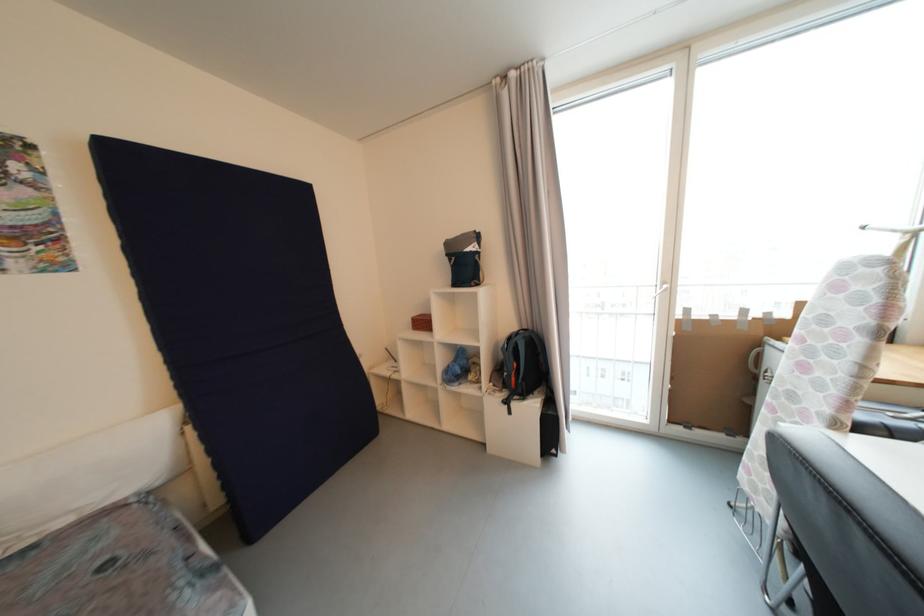
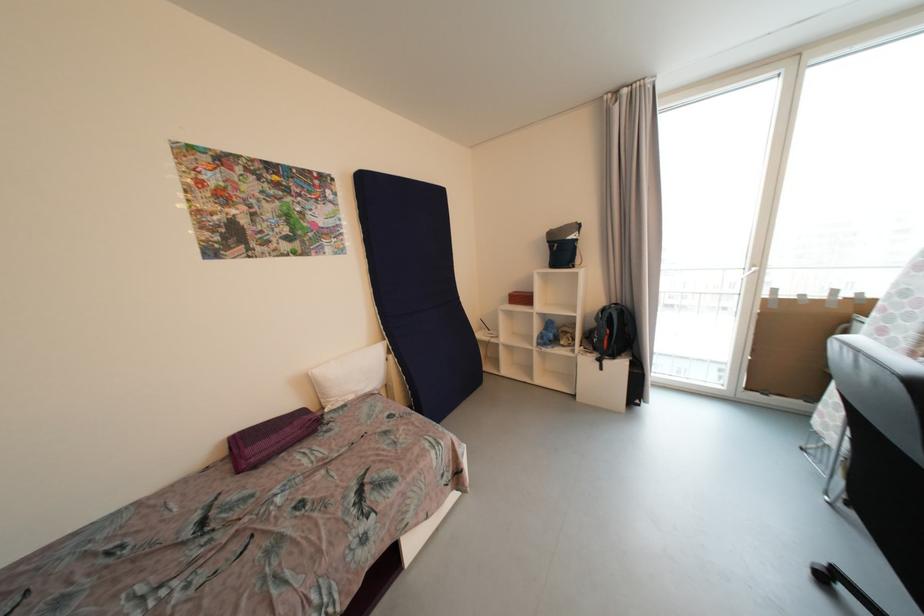
In the second image, find the point that corresponds to (428,326) in the first image.

(528, 300)